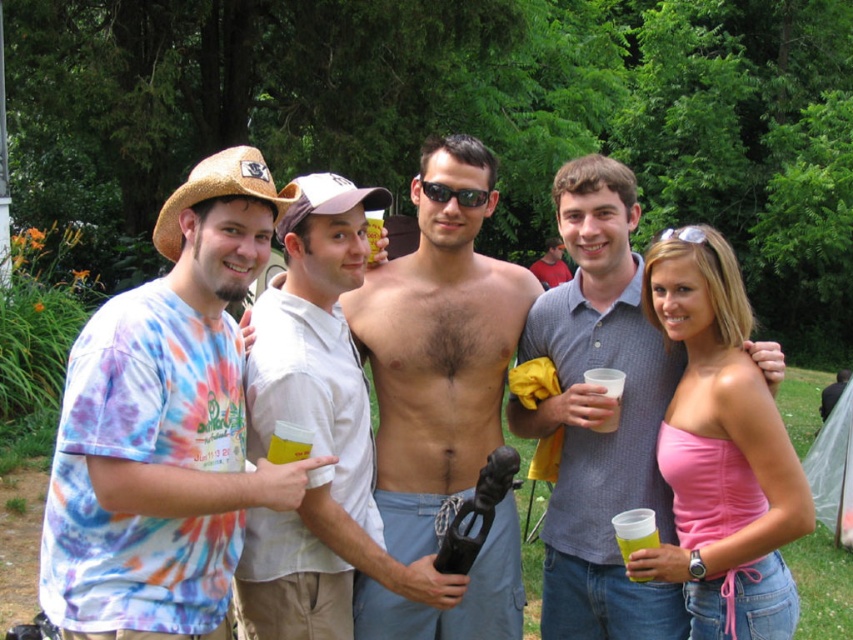
Question: Which point is farther from the camera taking this photo?

Choices:
 (A) (633, 536)
 (B) (741, 627)
 (C) (157, 480)

Answer: (B)

Question: Among these points, which one is farthest from the camera?

Choices:
 (A) (357, 195)
 (B) (738, 520)

Answer: (A)

Question: Can you confirm if gray textured polo shirt at center is bigger than sunglasses at center?

Choices:
 (A) no
 (B) yes

Answer: (B)

Question: Observing the image, what is the correct spatial positioning of tie-dye fabric shirt at left in reference to sunglasses at center?

Choices:
 (A) right
 (B) left

Answer: (B)

Question: Which point appears farthest from the camera in this image?

Choices:
 (A) (138, 534)
 (B) (666, 380)

Answer: (B)

Question: Is strawhat at left to the left of brown straw cowboy hat at upper left from the viewer's perspective?

Choices:
 (A) yes
 (B) no

Answer: (A)